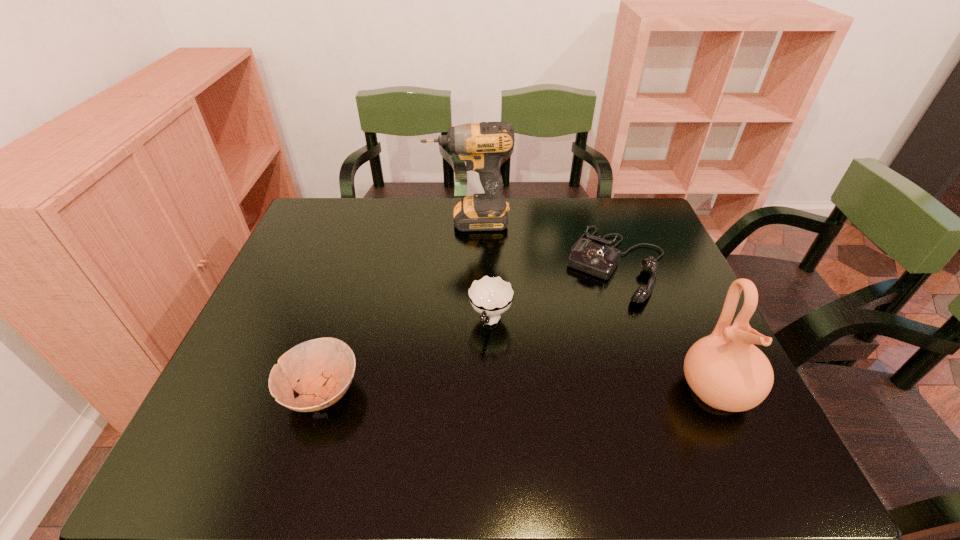
Locate an element on the screen. Image resolution: width=960 pixels, height=540 pixels. object that is at the left edge is located at coordinates (325, 367).

You are a GUI agent. You are given a task and a screenshot of the screen. Output one action in this format:
    pyautogui.click(x=<x>, y=<y>)
    Task: Click on the pottery at the right edge
    This screenshot has width=960, height=540.
    Given the screenshot: What is the action you would take?
    pyautogui.click(x=725, y=370)

At what (x,y) coordinates should I click in order to perform the action: click on telephone at the right edge. Please return your answer as a coordinate pair (x, y). Looking at the image, I should click on (594, 257).

Find the location of a particular element. object that is at the near left corner is located at coordinates (325, 367).

The height and width of the screenshot is (540, 960). I want to click on object that is at the far right corner, so click(594, 257).

Locate an element on the screen. This screenshot has width=960, height=540. object situated at the near right corner is located at coordinates (725, 370).

Identify the location of vacant space at the far edge of the desktop. Image resolution: width=960 pixels, height=540 pixels. (359, 211).

This screenshot has width=960, height=540. Find the location of `free space at the near edge of the desktop`. free space at the near edge of the desktop is located at coordinates (530, 392).

The width and height of the screenshot is (960, 540). Find the location of `vacant space at the left edge of the desktop`. vacant space at the left edge of the desktop is located at coordinates (304, 313).

Where is `vacant space at the right edge`? This screenshot has width=960, height=540. vacant space at the right edge is located at coordinates (671, 371).